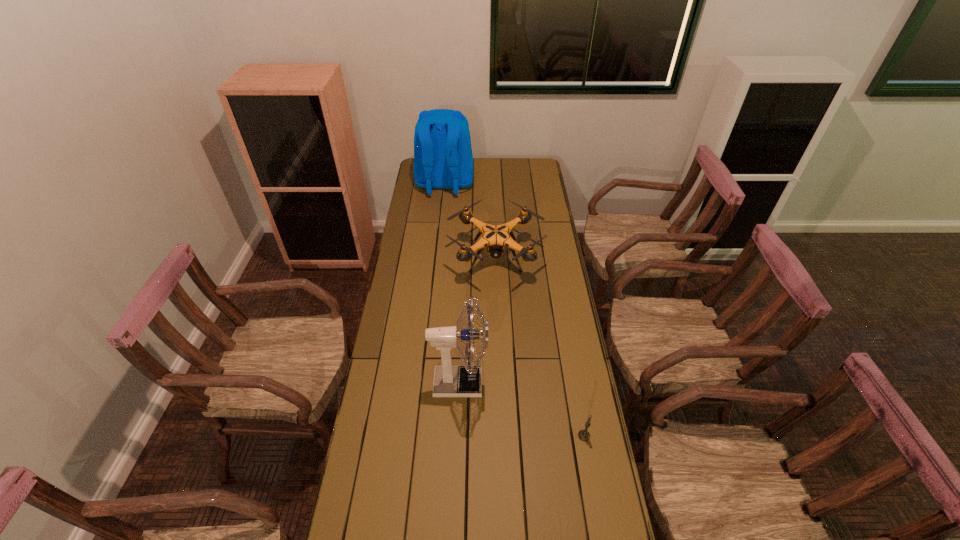
Find the location of `unoccupied position between the rightmost object and the backpack`. unoccupied position between the rightmost object and the backpack is located at coordinates (515, 310).

Find the location of `empty space that is in between the rightmost object and the farthest object`. empty space that is in between the rightmost object and the farthest object is located at coordinates (515, 310).

You are a GUI agent. You are given a task and a screenshot of the screen. Output one action in this format:
    pyautogui.click(x=<x>, y=<y>)
    Task: Click on the free area in between the farthest object and the second nearest object
    The height and width of the screenshot is (540, 960).
    Given the screenshot: What is the action you would take?
    pyautogui.click(x=452, y=284)

I want to click on free space between the second nearest object and the third nearest object, so click(x=477, y=321).

This screenshot has width=960, height=540. Find the location of `vacant area that lies between the drone and the candle`. vacant area that lies between the drone and the candle is located at coordinates (540, 348).

What are the coordinates of `vacant area between the third farthest object and the third nearest object` in the screenshot? It's located at (477, 321).

At what (x,y) coordinates should I click in order to perform the action: click on object that stands as the second closest to the backpack. Please return your answer as a coordinate pair (x, y). Looking at the image, I should click on (449, 381).

Image resolution: width=960 pixels, height=540 pixels. Find the location of `object that is the second closest to the third farthest object`. object that is the second closest to the third farthest object is located at coordinates (495, 238).

Where is `vacant area that satisfies the following two spatial constraints: 1. on the back of the shortest object; 2. on the left side of the farthest object`? The image size is (960, 540). vacant area that satisfies the following two spatial constraints: 1. on the back of the shortest object; 2. on the left side of the farthest object is located at coordinates (419, 436).

The height and width of the screenshot is (540, 960). Find the location of `free location that satisfies the following two spatial constraints: 1. on the front-facing side of the third farthest object; 2. on the left side of the nearest object`. free location that satisfies the following two spatial constraints: 1. on the front-facing side of the third farthest object; 2. on the left side of the nearest object is located at coordinates (458, 436).